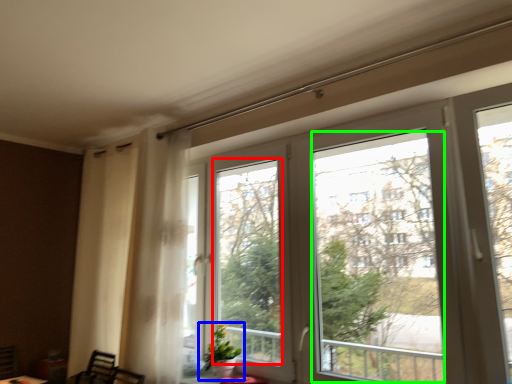
Question: Which object is positioned farthest from window screen (highlighted by a red box)? Select from houseplant (highlighted by a blue box) and window screen (highlighted by a green box).

Choices:
 (A) houseplant
 (B) window screen

Answer: (B)